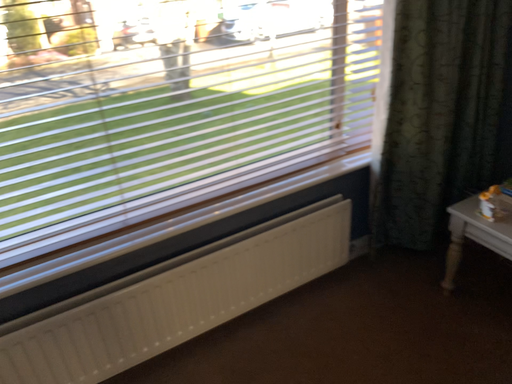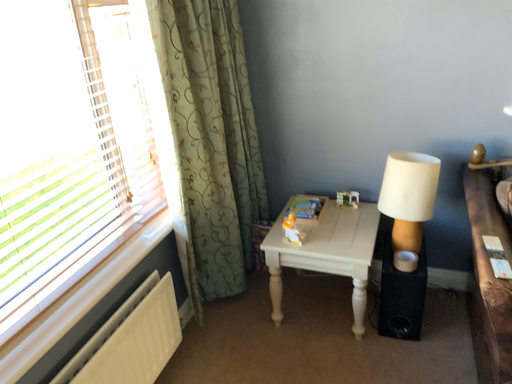
Question: How did the camera likely rotate when shooting the video?

Choices:
 (A) rotated downward
 (B) rotated upward

Answer: (B)